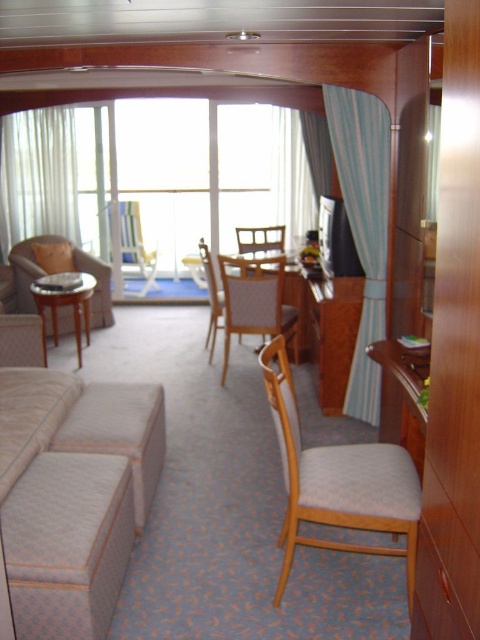
Question: Which object is closer to the camera taking this photo?

Choices:
 (A) blue striped curtain at upper center
 (B) white sheer curtains at left

Answer: (A)

Question: Can you confirm if blue striped curtain at right is smaller than light beige fabric couch at left?

Choices:
 (A) yes
 (B) no

Answer: (A)

Question: Can you confirm if blue striped curtain at right is positioned above light beige fabric couch at left?

Choices:
 (A) no
 (B) yes

Answer: (A)

Question: Which point is closer to the camera?

Choices:
 (A) (140, 243)
 (B) (63, 448)
 (C) (25, 291)

Answer: (B)

Question: Which of the following is the closest to the observer?

Choices:
 (A) white sheer curtains at left
 (B) light beige fabric armchair at center
 (C) light gray fabric chair at center
 (D) blue striped curtain at right

Answer: (D)

Question: Does light beige fabric couch at lower left have a lesser width compared to blue striped curtain at right?

Choices:
 (A) yes
 (B) no

Answer: (B)